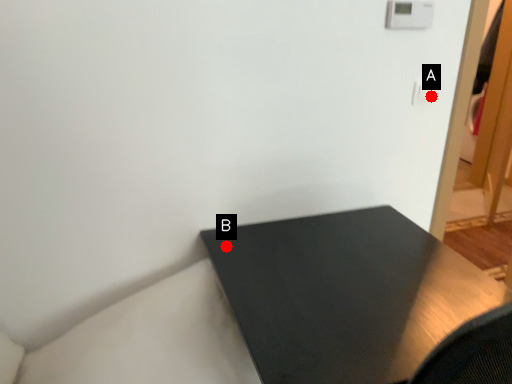
Question: Two points are circled on the image, labeled by A and B beside each circle. Which of the following is the farthest from the observer?

Choices:
 (A) A is further
 (B) B is further

Answer: (A)